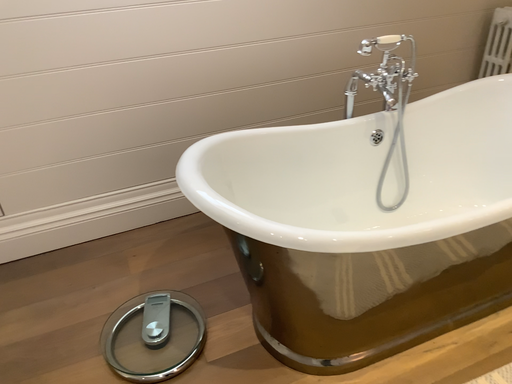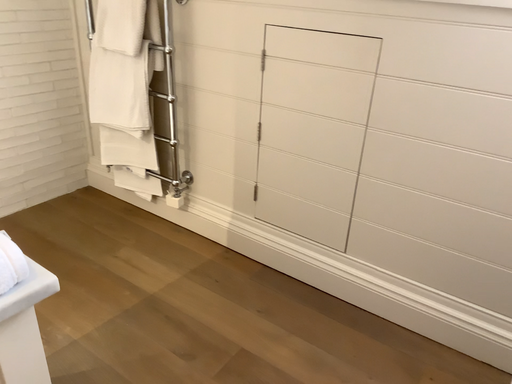
Question: How did the camera likely rotate when shooting the video?

Choices:
 (A) rotated downward
 (B) rotated upward

Answer: (B)